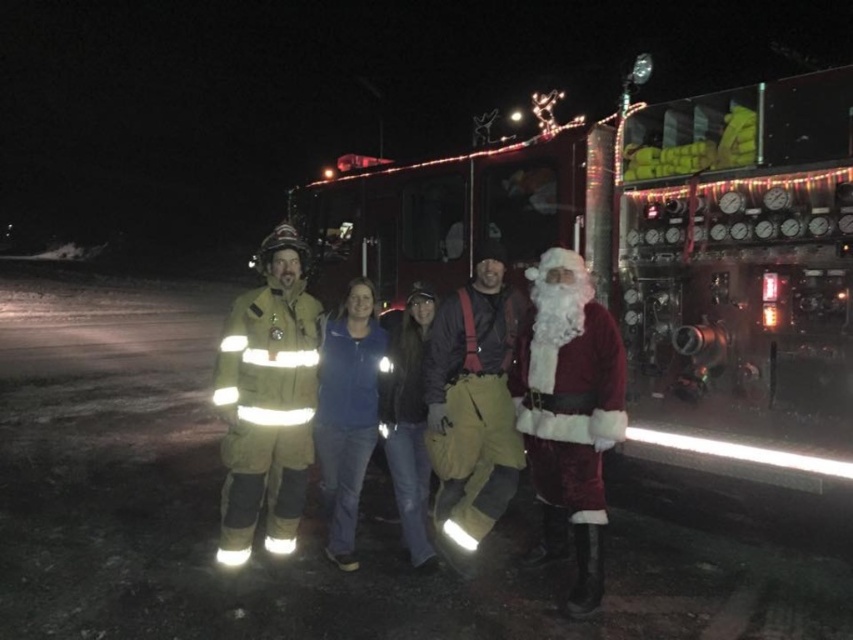
Question: Is red reflective fire truck at center below reflective yellow-green fireman suit at center?

Choices:
 (A) yes
 (B) no

Answer: (B)

Question: Among these objects, which one is farthest from the camera?

Choices:
 (A) velvet red santa at right
 (B) red reflective fire truck at center
 (C) reflective yellow-green fireman suit at center

Answer: (B)

Question: Can you confirm if reflective yellow-green fireman suit at center is positioned above blue fleece jacket at center?

Choices:
 (A) yes
 (B) no

Answer: (A)

Question: Which of the following is the closest to the observer?

Choices:
 (A) blue fleece jacket at center
 (B) velvet red santa at right

Answer: (B)

Question: In this image, where is velvet red santa at right located relative to reflective yellow-green fireman suit at center?

Choices:
 (A) above
 (B) below

Answer: (B)

Question: Among these points, which one is farthest from the camera?

Choices:
 (A) (273, 385)
 (B) (627, 387)
 (C) (341, 416)

Answer: (B)